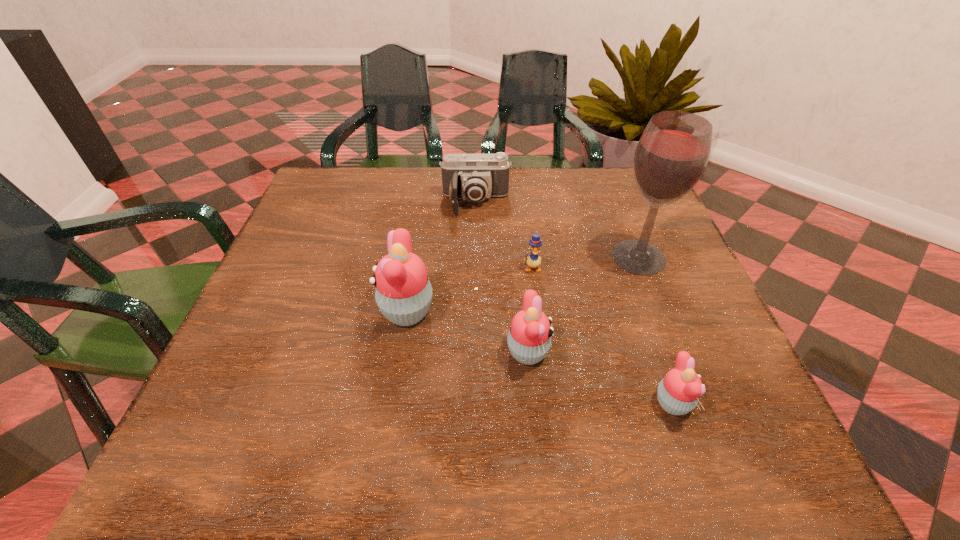
You are a GUI agent. You are given a task and a screenshot of the screen. Output one action in this format:
    pyautogui.click(x=<x>, y=<y>)
    Task: Click on the free space located on the face of the second cupcake from right to left
    Image resolution: width=960 pixels, height=540 pixels.
    Given the screenshot: What is the action you would take?
    coord(668,353)

The image size is (960, 540). Identify the location of free location located 0.070m on the face of the rightmost cupcake. (733, 403).

Where is `free space located 0.150m on the front of the tallest object`? free space located 0.150m on the front of the tallest object is located at coordinates (667, 330).

In order to click on vacant region located at the front of the camera with an open lens cover in this screenshot , I will do `click(473, 346)`.

Image resolution: width=960 pixels, height=540 pixels. In order to click on blank space located 0.180m on the face of the duckling, where the monocle is placed in this screenshot , I will do `click(540, 339)`.

Locate an element on the screen. object at the far edge is located at coordinates (474, 177).

This screenshot has height=540, width=960. Find the location of `cupcake positioned at the right edge`. cupcake positioned at the right edge is located at coordinates (678, 393).

Locate an element on the screen. The height and width of the screenshot is (540, 960). alcohol at the right edge is located at coordinates (671, 156).

At what (x,y) coordinates should I click in order to perform the action: click on object that is positioned at the near right corner. Please return your answer as a coordinate pair (x, y). This screenshot has width=960, height=540. Looking at the image, I should click on (678, 393).

Where is `free space at the far edge`? free space at the far edge is located at coordinates (379, 199).